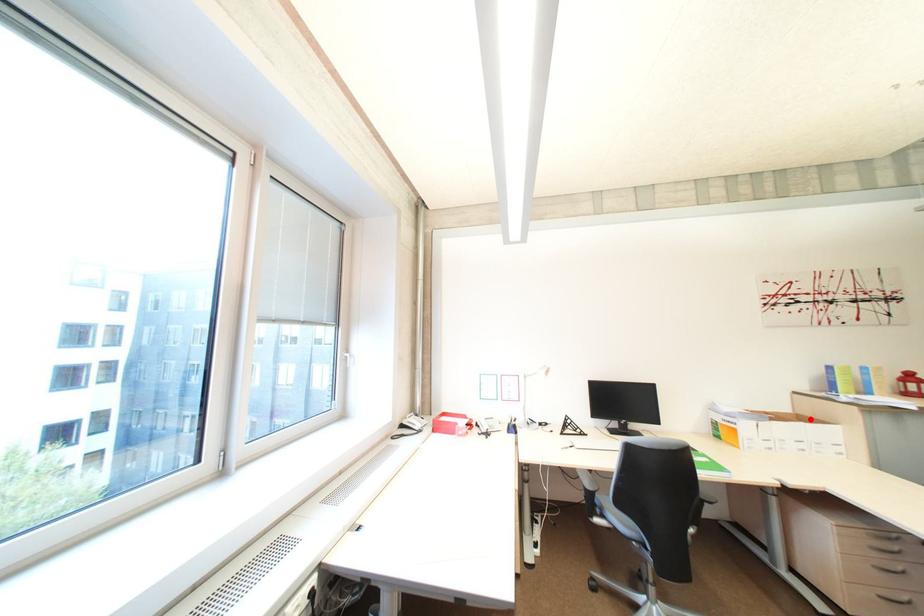
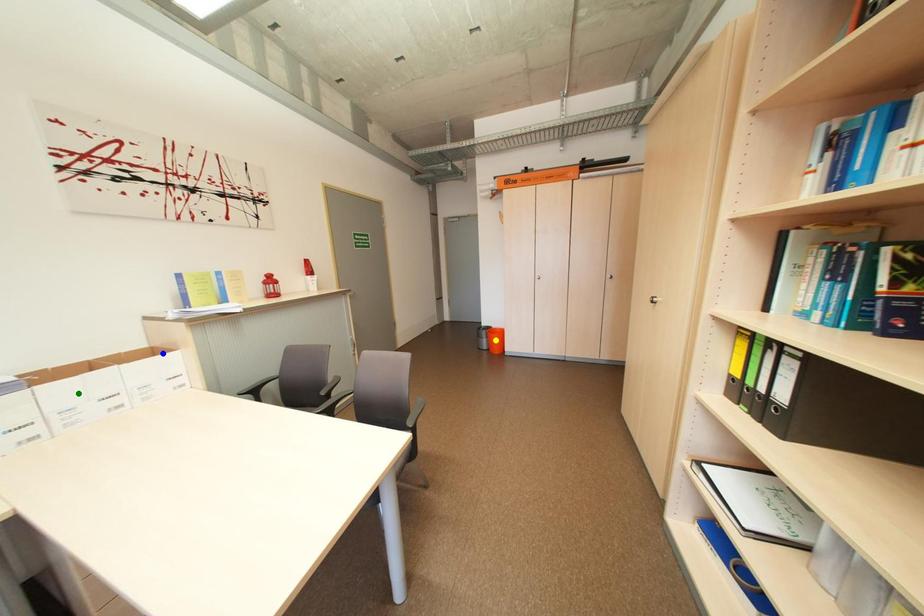
Question: I am providing you with two images of the same scene from different viewpoints. A red point is marked on the first image. You are given multiple points on the second image. In image 2, which mark is for the same physical point as the one in image 1?

Choices:
 (A) yellow point
 (B) blue point
 (C) green point

Answer: (B)